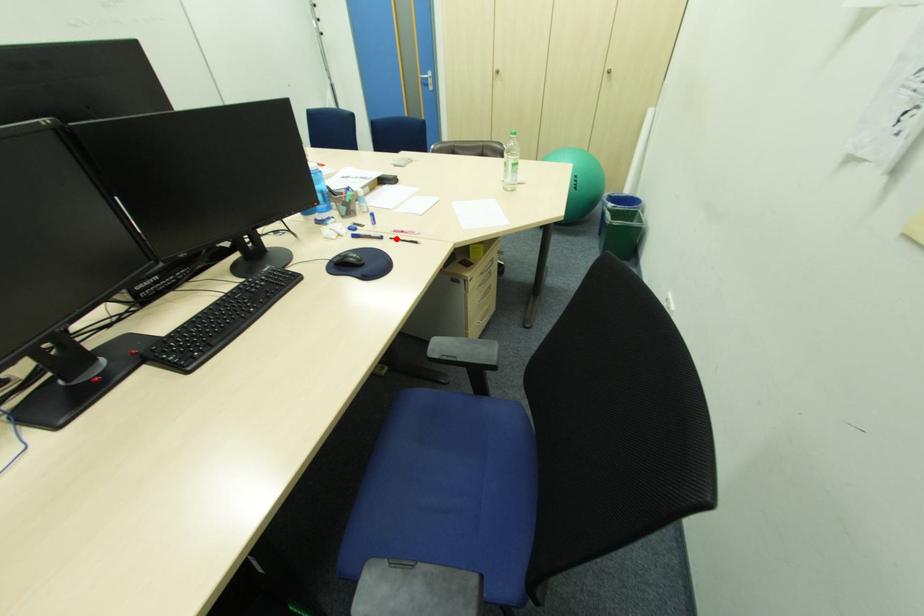
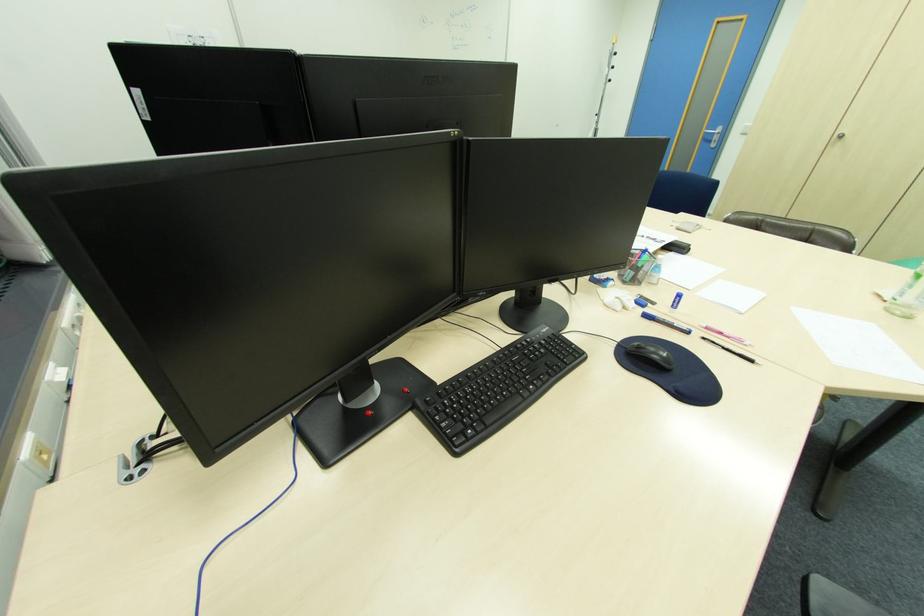
Where in the second image is the point corresponding to the highlighted location from the first image?

(709, 339)